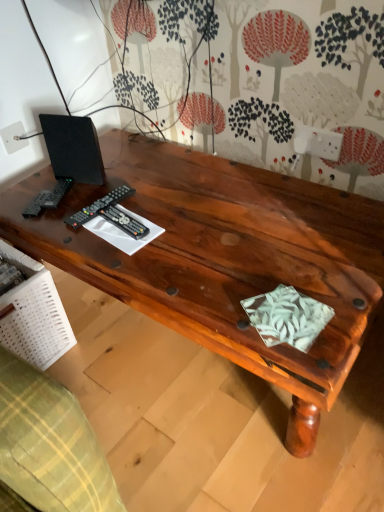
Locate an element on the screen. The height and width of the screenshot is (512, 384). blank space to the left of black matte speaker at upper left is located at coordinates (34, 190).